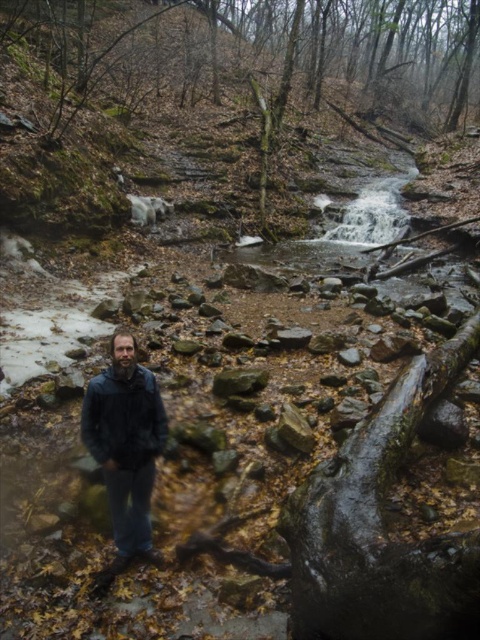
Question: From the image, what is the correct spatial relationship of dark blue jacket at center in relation to dark blue leather jacket at lower left?

Choices:
 (A) left
 (B) right

Answer: (A)

Question: Which point is closer to the camera?

Choices:
 (A) dark blue jacket at center
 (B) dark blue leather jacket at lower left

Answer: (A)

Question: Which object is closer to the camera taking this photo?

Choices:
 (A) brown mossy rocks at center
 (B) dark blue leather jacket at lower left
 (C) dark blue jacket at center

Answer: (C)

Question: Based on their relative distances, which object is farther from the dark blue jacket at center?

Choices:
 (A) brown mossy rocks at center
 (B) dark blue leather jacket at lower left

Answer: (A)

Question: Is brown mossy rocks at center thinner than dark blue jacket at center?

Choices:
 (A) no
 (B) yes

Answer: (A)

Question: Observing the image, what is the correct spatial positioning of brown mossy rocks at center in reference to dark blue leather jacket at lower left?

Choices:
 (A) left
 (B) right

Answer: (B)